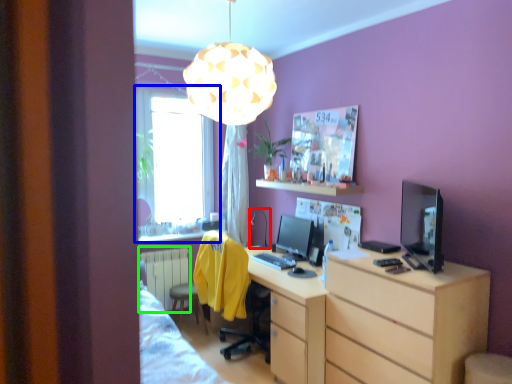
Question: Estimate the real-world distances between objects in this image. Which object is closer to table lamp (highlighted by a red box), window (highlighted by a blue box) or radiator (highlighted by a green box)?

Choices:
 (A) window
 (B) radiator

Answer: (B)